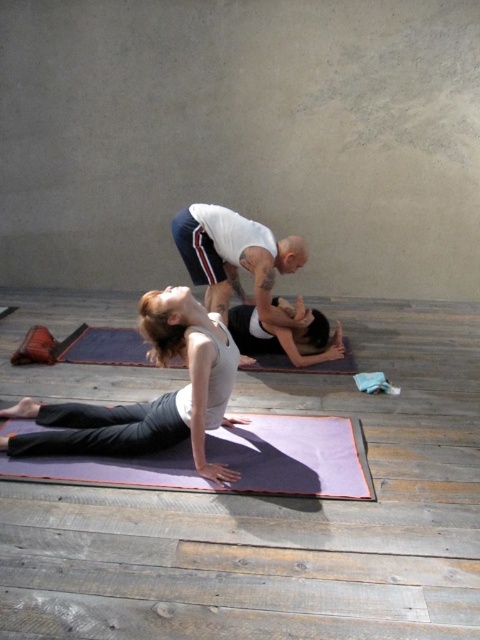
Which is more to the left, purple rubber yoga mat at lower center or wooden plank at lower center?

From the viewer's perspective, purple rubber yoga mat at lower center appears more on the left side.

Is point (155, 454) positioned after point (238, 604)?

Yes, it is behind point (238, 604).

Which is in front, point (276, 413) or point (407, 600)?

Positioned in front is point (407, 600).

Identify the location of purple rubber yoga mat at lower center. The width and height of the screenshot is (480, 640). (229, 460).

Between matte white tank top at center and purple rubber yoga mat at lower center, which one appears on the left side from the viewer's perspective?

From the viewer's perspective, matte white tank top at center appears more on the left side.

This screenshot has width=480, height=640. In order to click on matte white tank top at center in this screenshot , I will do `click(147, 401)`.

Consider the image. Does matte white tank top at center have a larger size compared to white tank top at center?

Indeed, matte white tank top at center has a larger size compared to white tank top at center.

Where is `matte white tank top at center`? This screenshot has height=640, width=480. matte white tank top at center is located at coordinates (147, 401).

Find the location of a particular element. matte white tank top at center is located at coordinates (147, 401).